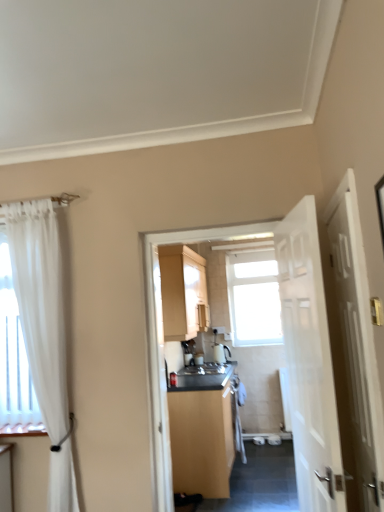
Question: Can you confirm if matte wood cabinet at center, which is counted as the second cabinetry, starting from the top, is positioned to the left of white glossy door at right, arranged as the first door when viewed from the right?

Choices:
 (A) no
 (B) yes

Answer: (B)

Question: Is matte wood cabinet at center, which is the first cabinetry in bottom-to-top order, looking in the opposite direction of white glossy door at right, the 2th door from the left?

Choices:
 (A) no
 (B) yes

Answer: (A)

Question: Could you tell me if matte wood cabinet at center, which is counted as the second cabinetry, starting from the top, is turned towards white glossy door at right, the 2th door from the left?

Choices:
 (A) yes
 (B) no

Answer: (B)

Question: Can you confirm if matte wood cabinet at center, which is counted as the second cabinetry, starting from the top, is shorter than white glossy door at right, arranged as the first door when viewed from the right?

Choices:
 (A) no
 (B) yes

Answer: (B)

Question: Is there a large distance between matte wood cabinet at center, which is the first cabinetry in bottom-to-top order, and white glossy door at right, the 2th door from the left?

Choices:
 (A) yes
 (B) no

Answer: (A)

Question: Is the position of matte wood cabinet at center, which is the first cabinetry in bottom-to-top order, less distant than that of white glossy door at right, the 2th door from the left?

Choices:
 (A) no
 (B) yes

Answer: (A)

Question: From the image's perspective, is white glossy door at right, arranged as the first door when viewed from the right, located beneath transparent glass window at center?

Choices:
 (A) yes
 (B) no

Answer: (B)

Question: Can you confirm if white glossy door at right, the 2th door from the left, is thinner than transparent glass window at center?

Choices:
 (A) no
 (B) yes

Answer: (A)

Question: Considering the relative positions of white glossy door at right, arranged as the first door when viewed from the right, and transparent glass window at center in the image provided, is white glossy door at right, arranged as the first door when viewed from the right, to the left of transparent glass window at center from the viewer's perspective?

Choices:
 (A) no
 (B) yes

Answer: (B)

Question: From a real-world perspective, is white glossy door at right, the 2th door from the left, located higher than transparent glass window at center?

Choices:
 (A) no
 (B) yes

Answer: (A)

Question: From a real-world perspective, is white glossy door at right, the 2th door from the left, under transparent glass window at center?

Choices:
 (A) no
 (B) yes

Answer: (B)

Question: Is white glossy door at right, the 2th door from the left, shorter than transparent glass window at center?

Choices:
 (A) no
 (B) yes

Answer: (A)

Question: Can you confirm if matte wood cabinet at center, which is counted as the second cabinetry, starting from the top, is positioned to the right of white glossy sink at center?

Choices:
 (A) yes
 (B) no

Answer: (A)